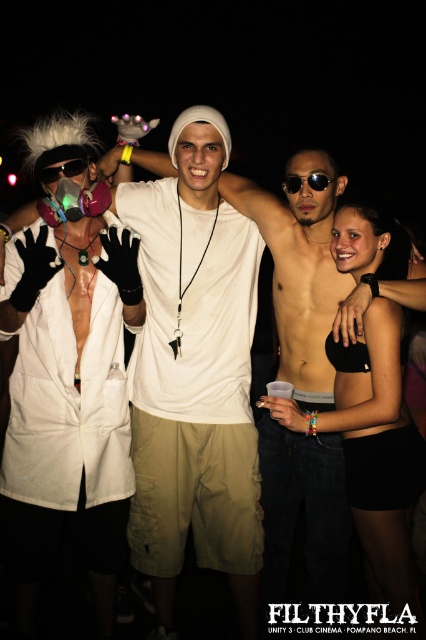
Which is behind, point (377, 257) or point (48, 182)?

The point (377, 257) is more distant.

Is black matte bikini bottom at center smaller than matte pink respirator at upper left?

No.

The width and height of the screenshot is (426, 640). What do you see at coordinates (374, 449) in the screenshot?
I see `black matte bikini bottom at center` at bounding box center [374, 449].

At what (x,y) coordinates should I click in order to perform the action: click on black matte bikini bottom at center. Please return your answer as a coordinate pair (x, y). Looking at the image, I should click on 374,449.

Image resolution: width=426 pixels, height=640 pixels. What do you see at coordinates (385, 464) in the screenshot? I see `black fabric bra at upper right` at bounding box center [385, 464].

Between black fabric bra at upper right and matte pink respirator at upper left, which one has less height?

matte pink respirator at upper left is shorter.

Which is in front, point (391, 474) or point (46, 173)?

Point (391, 474) is in front.

Locate an element on the screen. black fabric bra at upper right is located at coordinates (385, 464).

Looking at this image, can you confirm if white cotton shirt at center is shorter than black fabric bra at upper right?

Incorrect, white cotton shirt at center's height does not fall short of black fabric bra at upper right's.

Between white cotton shirt at center and black fabric bra at upper right, which one appears on the left side from the viewer's perspective?

From the viewer's perspective, white cotton shirt at center appears more on the left side.

Where is `white cotton shirt at center`? white cotton shirt at center is located at coordinates (302, 273).

The height and width of the screenshot is (640, 426). What are the coordinates of `white cotton shirt at center` in the screenshot? It's located at (302, 273).